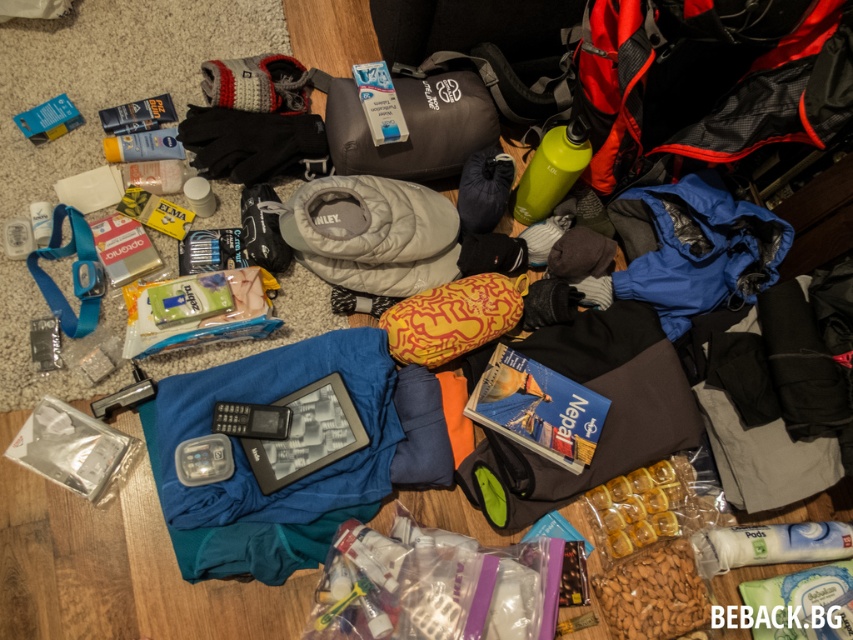
You are standing in the room and want to pick up two items located at the coordinates point (241, 513) and point (329, 218). Which item will require you to bend down less to reach?

Point (241, 513) is closer to the viewer than point (329, 218), so you will need to bend down less to reach the item at point (241, 513).

You are a traveler who needs to place a camera on the floor near the blue fabric at center without exceeding a 1.34 meter distance. Can you place the camera within the required distance?

The camera can be placed within the required distance because the blue fabric at center and camera are 1.34 meters apart.